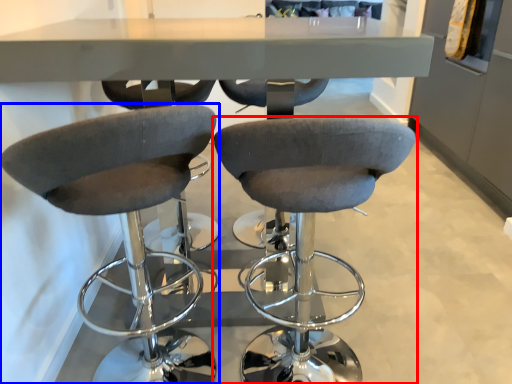
Question: Which object appears closest to the camera in this image, chair (highlighted by a red box) or chair (highlighted by a blue box)?

Choices:
 (A) chair
 (B) chair

Answer: (B)